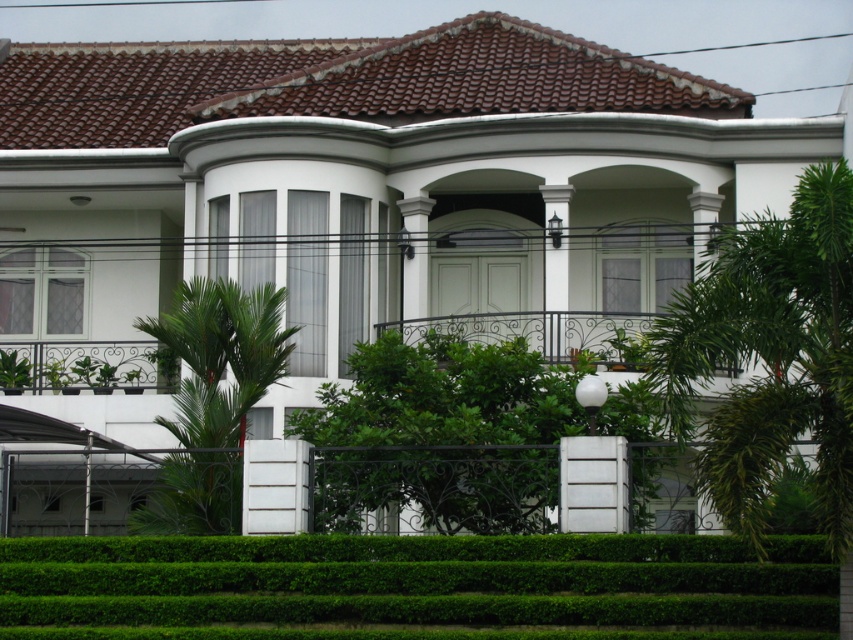
Question: Is green leafy hedge at lower center below green leafy palm tree at right?

Choices:
 (A) no
 (B) yes

Answer: (B)

Question: Where is green leafy hedge at center located in relation to green leafy palm tree at center in the image?

Choices:
 (A) below
 (B) above

Answer: (A)

Question: Which point appears closest to the camera in this image?

Choices:
 (A) (4, 600)
 (B) (189, 304)
 (C) (796, 310)

Answer: (C)

Question: Which of the following is the farthest from the observer?

Choices:
 (A) green leafy palm tree at center
 (B) green leafy palm tree at right
 (C) green leafy hedge at lower center
 (D) green leafy hedge at center

Answer: (A)

Question: Based on their relative distances, which object is nearer to the green leafy hedge at center?

Choices:
 (A) green leafy hedge at lower center
 (B) green leafy palm tree at center
 (C) green leafy palm tree at right

Answer: (A)

Question: Can you confirm if green leafy hedge at lower center is positioned to the right of green leafy hedge at center?

Choices:
 (A) no
 (B) yes

Answer: (A)